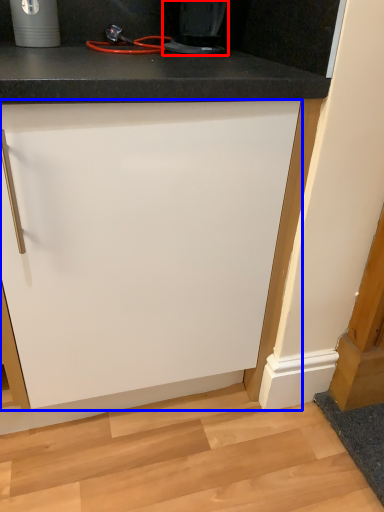
Question: Among these objects, which one is nearest to the camera, home appliance (highlighted by a red box) or cabinetry (highlighted by a blue box)?

Choices:
 (A) home appliance
 (B) cabinetry

Answer: (B)